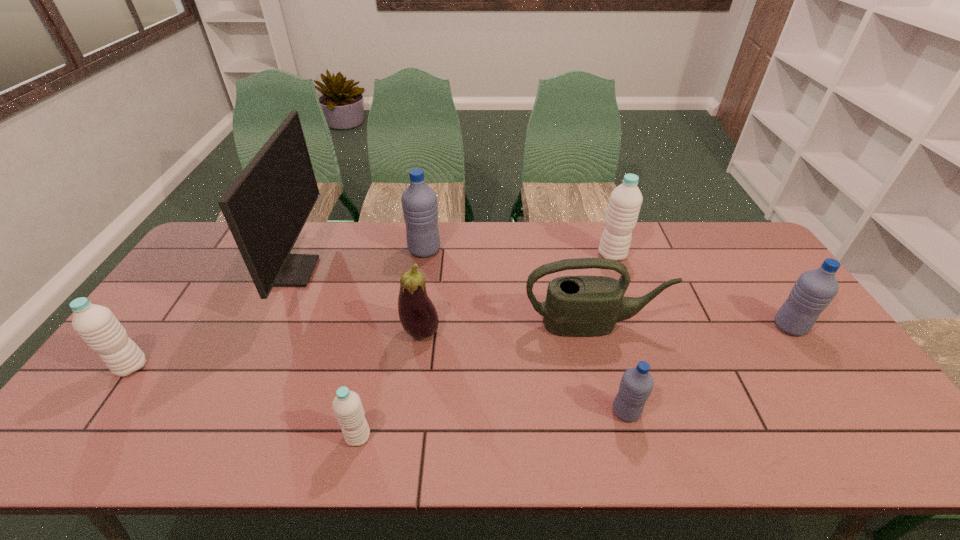
At what (x,y) coordinates should I click in order to perform the action: click on computer monitor. Please return your answer as a coordinate pair (x, y). Image resolution: width=960 pixels, height=540 pixels. Looking at the image, I should click on (266, 207).

Find the location of a particular element. This screenshot has height=540, width=960. the tallest object is located at coordinates (266, 207).

This screenshot has width=960, height=540. What are the coordinates of `the biggest blue water bottle` in the screenshot? It's located at (419, 202).

In order to click on the fourth water bottle from right to left in this screenshot , I will do `click(419, 202)`.

At what (x,y) coordinates should I click in order to perform the action: click on the rightmost white water bottle. Please return your answer as a coordinate pair (x, y). The height and width of the screenshot is (540, 960). Looking at the image, I should click on (625, 201).

Where is `the second water bottle from right to left`? the second water bottle from right to left is located at coordinates (625, 201).

Locate an element on the screen. eggplant is located at coordinates (418, 316).

Find the location of a particular element. The image size is (960, 540). watering can is located at coordinates point(581,306).

Locate an element on the screen. Image resolution: width=960 pixels, height=540 pixels. the third farthest water bottle is located at coordinates (814, 290).

This screenshot has width=960, height=540. What are the coordinates of `the second nearest blue water bottle` in the screenshot? It's located at (814, 290).